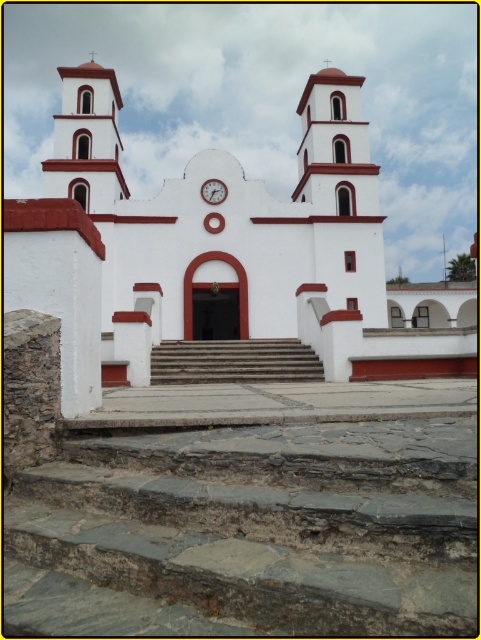
Does gray stone stairs at center come in front of smooth stone stairs at center?

That is True.

Does gray stone stairs at center appear on the right side of smooth stone stairs at center?

Yes, gray stone stairs at center is to the right of smooth stone stairs at center.

Which is behind, point (21, 522) or point (243, 342)?

The point (243, 342) is more distant.

Where is `gray stone stairs at center`? The image size is (481, 640). gray stone stairs at center is located at coordinates (268, 522).

Who is taller, white matte church at center or white matte clock at center?

white matte church at center

Between point (89, 304) and point (218, 186), which one is positioned behind?

Point (218, 186)

Which is in front, point (25, 252) or point (207, 189)?

Positioned in front is point (25, 252).

At what (x,y) coordinates should I click in order to perform the action: click on white matte church at center. Please return your answer as a coordinate pair (x, y). The height and width of the screenshot is (640, 481). Looking at the image, I should click on (211, 248).

Can you confirm if white stucco spire at upper left is bigger than white matte clock at center?

Yes, white stucco spire at upper left is bigger than white matte clock at center.

What do you see at coordinates (87, 138) in the screenshot? The image size is (481, 640). I see `white stucco spire at upper left` at bounding box center [87, 138].

What are the coordinates of `white stucco spire at upper left` in the screenshot? It's located at (87, 138).